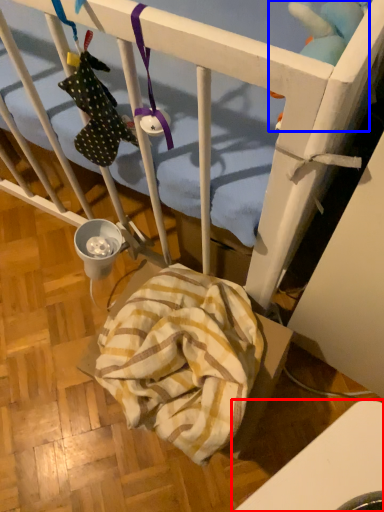
Question: Which of the following is the closest to the observer, furniture (highlighted by a red box) or toy (highlighted by a blue box)?

Choices:
 (A) furniture
 (B) toy

Answer: (A)